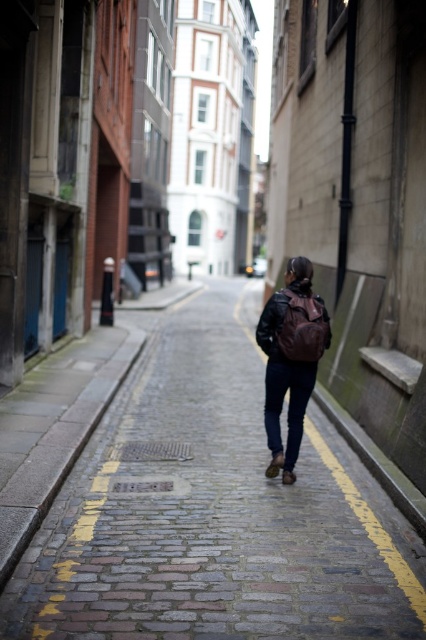
Does cobblestone pavement at center have a greater height compared to leather jacket at center?

Correct, cobblestone pavement at center is much taller as leather jacket at center.

Who is lower down, cobblestone pavement at center or leather jacket at center?

Positioned lower is cobblestone pavement at center.

Is point (287, 588) closer to camera compared to point (325, 321)?

Yes, point (287, 588) is closer to viewer.

Image resolution: width=426 pixels, height=640 pixels. Identify the location of cobblestone pavement at center. (213, 513).

Which is more to the left, matte brown backpack at center or leather jacket at center?

From the viewer's perspective, matte brown backpack at center appears more on the left side.

Is point (298, 381) closer to camera compared to point (268, 332)?

No, it is behind (268, 332).

Locate an element on the screen. matte brown backpack at center is located at coordinates (290, 358).

Is cobblestone pavement at center below matte brown backpack at center?

Yes, cobblestone pavement at center is below matte brown backpack at center.

Does cobblestone pavement at center have a lesser height compared to matte brown backpack at center?

Correct, cobblestone pavement at center is not as tall as matte brown backpack at center.

Measure the distance between cobblestone pavement at center and camera.

A distance of 3.93 meters exists between cobblestone pavement at center and camera.

Identify the location of cobblestone pavement at center. The height and width of the screenshot is (640, 426). (213, 513).